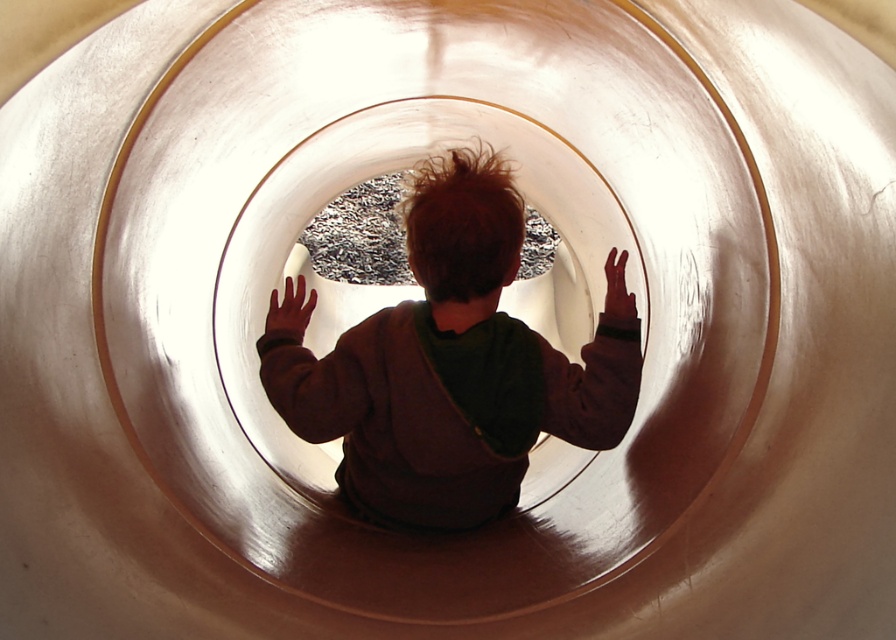
Consider the image. You are a photographer trying to capture the child in the tunnel. You notice the matte brown hoodie at center and the brown leather hand at center. Which object is closer to the camera lens?

The matte brown hoodie at center is closer to the camera lens because it is in front of the brown leather hand at center.

Based on the photo, you are a photographer trying to capture the reflection in the tunnel walls. You notice the matte brown hoodie at center and the brown leather hand at center. Which object appears larger in the reflection?

The matte brown hoodie at center appears larger in the reflection because it is taller than the brown leather hand at center.

You are a child inside a shiny playground tunnel. You notice two hands touching the tunnel walls at the center. Which hand is shorter between the matte brown hand at center and the brown leather hand at center?

The matte brown hand at center is shorter than the brown leather hand at center.